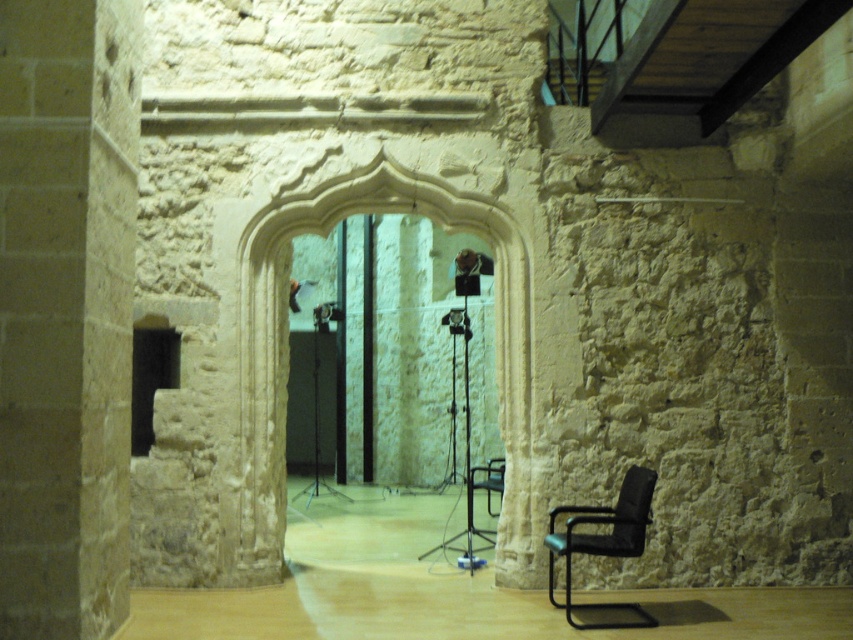
Can you confirm if smooth stone pillar at left is positioned above black leather armchair at lower right?

Correct, smooth stone pillar at left is located above black leather armchair at lower right.

Is point (90, 120) less distant than point (550, 532)?

Yes, point (90, 120) is closer to viewer.

Between point (51, 400) and point (566, 609), which one is positioned behind?

The point (566, 609) is behind.

Identify the location of smooth stone pillar at left. (67, 310).

Which is behind, point (512, 532) or point (555, 536)?

The point (512, 532) is more distant.

Which is more to the right, white stone archway at center or black leather armchair at lower right?

black leather armchair at lower right is more to the right.

Which is in front, point (254, 330) or point (569, 612)?

Positioned in front is point (569, 612).

Image resolution: width=853 pixels, height=640 pixels. What are the coordinates of `white stone archway at center` in the screenshot? It's located at (283, 330).

Between smooth stone pillar at left and white stone archway at center, which one has less height?

white stone archway at center

Does point (32, 456) come farther from viewer compared to point (503, 294)?

No, (32, 456) is in front of (503, 294).

This screenshot has width=853, height=640. Describe the element at coordinates (67, 310) in the screenshot. I see `smooth stone pillar at left` at that location.

Locate an element on the screen. smooth stone pillar at left is located at coordinates (67, 310).